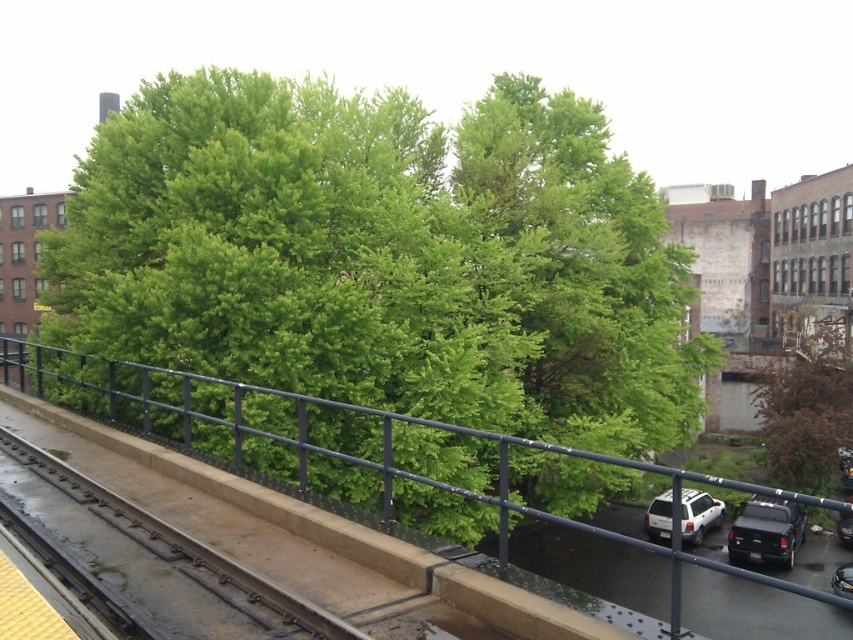
Can you confirm if smooth concrete train track at lower left is positioned above shiny black car at lower right?

Yes, smooth concrete train track at lower left is above shiny black car at lower right.

Can you confirm if smooth concrete train track at lower left is bigger than shiny black car at lower right?

No.

You are a GUI agent. You are given a task and a screenshot of the screen. Output one action in this format:
    pyautogui.click(x=<x>, y=<y>)
    Task: Click on the smooth concrete train track at lower left
    
    Given the screenshot: What is the action you would take?
    pyautogui.click(x=184, y=552)

Identify the location of smooth concrete train track at lower left. (184, 552).

What do you see at coordinates (347, 452) in the screenshot? I see `black metal rail at center` at bounding box center [347, 452].

Does point (241, 452) come in front of point (850, 563)?

Yes, it is in front of point (850, 563).

Where is `black metal rail at center`? This screenshot has width=853, height=640. black metal rail at center is located at coordinates (347, 452).

Locate an element on the screen. The width and height of the screenshot is (853, 640). black metal rail at center is located at coordinates (347, 452).

Does brown textured tree at lower right lie behind white matte suv at lower right?

Yes, brown textured tree at lower right is further from the viewer.

Who is shorter, brown textured tree at lower right or white matte suv at lower right?

white matte suv at lower right is shorter.

Is point (787, 352) less distant than point (688, 515)?

No, it is not.

The image size is (853, 640). I want to click on brown textured tree at lower right, so click(807, 403).